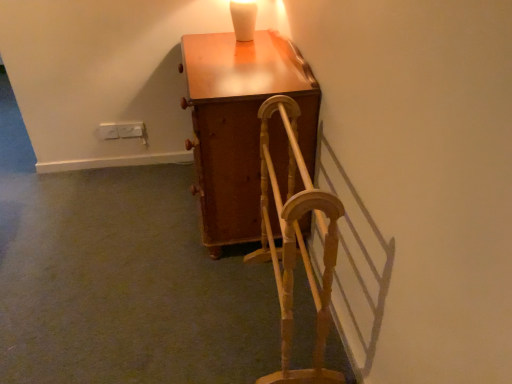
Question: Considering the relative sizes of wooden textured rocking chair at center and wooden cabinet at center in the image provided, is wooden textured rocking chair at center thinner than wooden cabinet at center?

Choices:
 (A) yes
 (B) no

Answer: (A)

Question: From a real-world perspective, is wooden textured rocking chair at center on wooden cabinet at center?

Choices:
 (A) no
 (B) yes

Answer: (A)

Question: Is wooden textured rocking chair at center not within wooden cabinet at center?

Choices:
 (A) yes
 (B) no

Answer: (A)

Question: Is wooden textured rocking chair at center wider than wooden cabinet at center?

Choices:
 (A) yes
 (B) no

Answer: (B)

Question: Can you confirm if wooden textured rocking chair at center is shorter than wooden cabinet at center?

Choices:
 (A) no
 (B) yes

Answer: (B)

Question: Is wooden textured rocking chair at center placed right next to wooden cabinet at center?

Choices:
 (A) yes
 (B) no

Answer: (B)

Question: Does wooden cabinet at center lie in front of wooden textured rocking chair at center?

Choices:
 (A) no
 (B) yes

Answer: (A)

Question: Is wooden cabinet at center wider than wooden textured rocking chair at center?

Choices:
 (A) no
 (B) yes

Answer: (B)

Question: Does wooden cabinet at center contain wooden textured rocking chair at center?

Choices:
 (A) yes
 (B) no

Answer: (B)

Question: Is wooden cabinet at center positioned with its back to wooden textured rocking chair at center?

Choices:
 (A) yes
 (B) no

Answer: (B)

Question: Is wooden cabinet at center completely or partially outside of wooden textured rocking chair at center?

Choices:
 (A) yes
 (B) no

Answer: (A)

Question: Considering the relative sizes of wooden cabinet at center and wooden textured rocking chair at center in the image provided, is wooden cabinet at center taller than wooden textured rocking chair at center?

Choices:
 (A) no
 (B) yes

Answer: (B)

Question: Considering the positions of wooden cabinet at center and wooden textured rocking chair at center in the image, is wooden cabinet at center bigger or smaller than wooden textured rocking chair at center?

Choices:
 (A) small
 (B) big

Answer: (B)